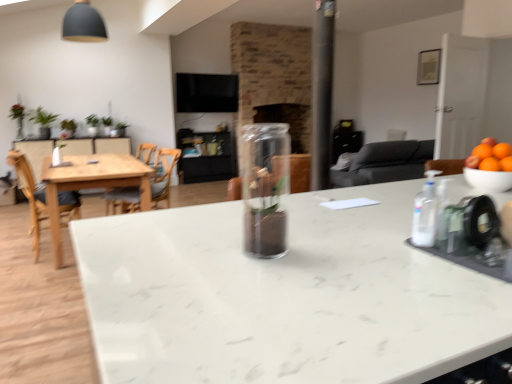
What is the approximate height of wooden chair at left, the first chair positioned from the right?

The height of wooden chair at left, the first chair positioned from the right, is 25.84 inches.

You are a GUI agent. You are given a task and a screenshot of the screen. Output one action in this format:
    pyautogui.click(x=<x>, y=<y>)
    Task: Click on the white marble countertop at center
    The height and width of the screenshot is (384, 512).
    Given the screenshot: What is the action you would take?
    pyautogui.click(x=283, y=297)

This screenshot has height=384, width=512. What do you see at coordinates (283, 297) in the screenshot? I see `white marble countertop at center` at bounding box center [283, 297].

You are a GUI agent. You are given a task and a screenshot of the screen. Output one action in this format:
    pyautogui.click(x=<x>, y=<y>)
    Task: Click on the transparent plastic bottle at right
    Image resolution: width=512 pixels, height=384 pixels.
    Given the screenshot: What is the action you would take?
    pyautogui.click(x=425, y=213)

Measure the distance between matte gray lampshade at upper left and camera.

The distance of matte gray lampshade at upper left from camera is 3.78 meters.

At what (x,y) coordinates should I click in order to perform the action: click on orange matte bowl at right. Please return your answer as a coordinate pair (x, y). The image size is (512, 384). Looking at the image, I should click on (490, 156).

From a real-world perspective, is wooden chair at left, positioned as the 2th chair in left-to-right order, over light wood table at left?

Indeed, from a real-world perspective, wooden chair at left, positioned as the 2th chair in left-to-right order, stands above light wood table at left.

Between wooden chair at left, the first chair positioned from the right, and light wood table at left, which one has smaller size?

With smaller size is wooden chair at left, the first chair positioned from the right.

Which is more distant, (155, 166) or (126, 177)?

The point (155, 166) is farther.

From the image's perspective, does wooden chair at left, positioned as the 2th chair in left-to-right order, appear higher than light wood table at left?

Yes, from the image's perspective, wooden chair at left, positioned as the 2th chair in left-to-right order, is over light wood table at left.

Locate an element on the screen. Image resolution: width=512 pixels, height=384 pixels. orange above the white glossy bowl at right (from the image's perspective) is located at coordinates (490, 156).

Which of these two, white glossy bowl at right or orange matte bowl at right, is bigger?

With larger size is orange matte bowl at right.

Is the surface of white glossy bowl at right in direct contact with orange matte bowl at right?

Yes, white glossy bowl at right is beside orange matte bowl at right.

Considering the relative sizes of white glossy bowl at right and orange matte bowl at right in the image provided, is white glossy bowl at right wider than orange matte bowl at right?

No.

From the image's perspective, is matte gray lampshade at upper left located beneath transparent plastic bottle at right?

No, from the image's perspective, matte gray lampshade at upper left is not below transparent plastic bottle at right.

Is matte gray lampshade at upper left touching transparent plastic bottle at right?

No.

Consider the image. Who is smaller, matte gray lampshade at upper left or transparent plastic bottle at right?

With smaller size is transparent plastic bottle at right.

From a real-world perspective, is matte gray lampshade at upper left above or below transparent plastic bottle at right?

From a real-world perspective, matte gray lampshade at upper left is physically above transparent plastic bottle at right.

Is white marble countertop at center looking in the opposite direction of wooden chair at left, which ranks as the 2th chair in right-to-left order?

That's not correct — white marble countertop at center is not looking away from wooden chair at left, which ranks as the 2th chair in right-to-left order.

Between point (389, 257) and point (61, 204), which one is positioned in front?

Positioned in front is point (389, 257).

Considering the relative sizes of white marble countertop at center and wooden chair at left, which ranks as the 2th chair in right-to-left order, in the image provided, is white marble countertop at center wider than wooden chair at left, which ranks as the 2th chair in right-to-left order,?

Correct, the width of white marble countertop at center exceeds that of wooden chair at left, which ranks as the 2th chair in right-to-left order.

How far apart are light wood table at left and white marble countertop at center?

light wood table at left and white marble countertop at center are 2.70 meters apart from each other.

In the image, is light wood table at left positioned in front of or behind white marble countertop at center?

light wood table at left is positioned farther from the viewer than white marble countertop at center.

Is light wood table at left wider or thinner than white marble countertop at center?

In the image, light wood table at left appears to be more narrow than white marble countertop at center.

The image size is (512, 384). I want to click on countertop in front of the light wood table at left, so click(x=283, y=297).

Is matte gray lampshade at upper left far away from transparent glass vase at center?

Indeed, matte gray lampshade at upper left is not near transparent glass vase at center.

What's the angular difference between matte gray lampshade at upper left and transparent glass vase at center's facing directions?

84.1 degrees separate the facing orientations of matte gray lampshade at upper left and transparent glass vase at center.

From a real-world perspective, is matte gray lampshade at upper left below transparent glass vase at center?

Incorrect, from a real-world perspective, matte gray lampshade at upper left is higher than transparent glass vase at center.

Considering the sizes of matte gray lampshade at upper left and transparent glass vase at center in the image, is matte gray lampshade at upper left taller or shorter than transparent glass vase at center?

A: Clearly, matte gray lampshade at upper left is taller compared to transparent glass vase at center.

Is orange matte bowl at right placed right next to transparent plastic bottle at right?

No, orange matte bowl at right is not next to transparent plastic bottle at right.

Considering the sizes of objects orange matte bowl at right and transparent plastic bottle at right in the image provided, who is thinner, orange matte bowl at right or transparent plastic bottle at right?

With smaller width is transparent plastic bottle at right.

From a real-world perspective, who is located lower, orange matte bowl at right or transparent plastic bottle at right?

transparent plastic bottle at right, from a real-world perspective.

At what (x,y) coordinates should I click in order to perform the action: click on kitchen & dining room table below the wooden chair at left, positioned as the 2th chair in left-to-right order (from the image's perspective). Please return your answer as a coordinate pair (x, y). Looking at the image, I should click on (105, 184).

Locate an element on the screen. The height and width of the screenshot is (384, 512). bowl below the orange matte bowl at right (from a real-world perspective) is located at coordinates (488, 180).

Looking at the image, which one is located closer to transparent glass vase at center, orange matte bowl at right or transparent plastic bottle at right?

transparent plastic bottle at right is positioned closer to the anchor transparent glass vase at center.

When comparing their distances from white marble countertop at center, does wooden chair at left, the first chair positioned from the right, or orange matte bowl at right seem further?

wooden chair at left, the first chair positioned from the right, is further to white marble countertop at center.

Considering their positions, is wooden chair at left, which ranks as the 2th chair in right-to-left order, positioned closer to white marble countertop at center than white glossy bowl at right?

white glossy bowl at right is closer to white marble countertop at center.

When comparing their distances from transparent glass vase at center, does white glossy bowl at right or matte gray lampshade at upper left seem closer?

→ white glossy bowl at right lies closer to transparent glass vase at center than the other object.

From the image, which object appears to be nearer to white glossy bowl at right, matte gray lampshade at upper left or wooden chair at left, positioned as the 2th chair in left-to-right order?

The object closer to white glossy bowl at right is wooden chair at left, positioned as the 2th chair in left-to-right order.

Which object lies nearer to the anchor point white glossy bowl at right, wooden chair at left, the first chair positioned from the right, or transparent glass vase at center?

transparent glass vase at center is closer to white glossy bowl at right.

From the image, which object appears to be farther from transparent glass vase at center, matte gray lampshade at upper left or wooden chair at left, the first chair positioned from the right?

The object further to transparent glass vase at center is matte gray lampshade at upper left.

Looking at the image, which one is located further to orange matte bowl at right, wooden chair at left, which ranks as the 2th chair in right-to-left order, or light wood table at left?

wooden chair at left, which ranks as the 2th chair in right-to-left order, is further to orange matte bowl at right.

Locate an element on the screen. orange positioned between white marble countertop at center and matte gray lampshade at upper left from near to far is located at coordinates (490, 156).

Image resolution: width=512 pixels, height=384 pixels. In order to click on chair between matte gray lampshade at upper left and white glossy bowl at right from left to right in this screenshot , I will do `click(163, 174)`.

Where is `bottle between matte gray lampshade at upper left and white glossy bowl at right in the horizontal direction`? The width and height of the screenshot is (512, 384). bottle between matte gray lampshade at upper left and white glossy bowl at right in the horizontal direction is located at coordinates (425, 213).

Where is `chair between light wood table at left and white glossy bowl at right in the horizontal direction`? chair between light wood table at left and white glossy bowl at right in the horizontal direction is located at coordinates (163, 174).